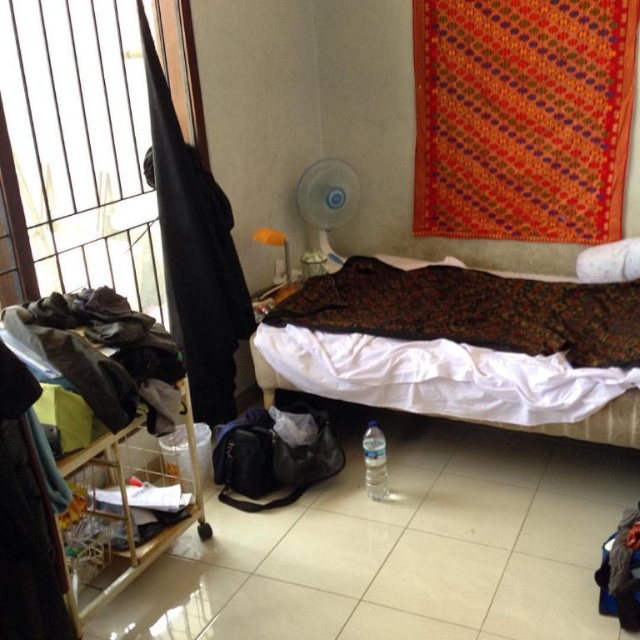
Locate an element on the screen. floral-patterned fabric at center is located at coordinates [x=472, y=310].

Between floral-patterned fabric at center and clear plastic bottle at center, which one has more height?

With more height is floral-patterned fabric at center.

Is point (582, 310) farther from viewer compared to point (371, 458)?

Yes, point (582, 310) is behind point (371, 458).

The height and width of the screenshot is (640, 640). Identify the location of floral-patterned fabric at center. (472, 310).

Does patterned fabric bed at center have a larger size compared to floral-patterned fabric at center?

Incorrect, patterned fabric bed at center is not larger than floral-patterned fabric at center.

Which is above, patterned fabric bed at center or floral-patterned fabric at center?

floral-patterned fabric at center

Who is more distant from viewer, (417, 360) or (356, 300)?

The point (356, 300) is behind.

Identify the location of patterned fabric bed at center. (452, 381).

Is red woven cloth at upper right taller than floral-patterned fabric at center?

Yes.

Can you confirm if red woven cloth at upper right is positioned to the left of floral-patterned fabric at center?

Incorrect, red woven cloth at upper right is not on the left side of floral-patterned fabric at center.

Find the location of `red woven cloth at upper right`. red woven cloth at upper right is located at coordinates (522, 116).